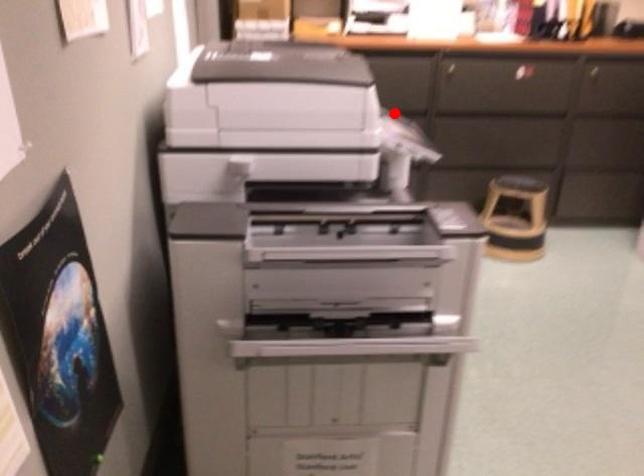
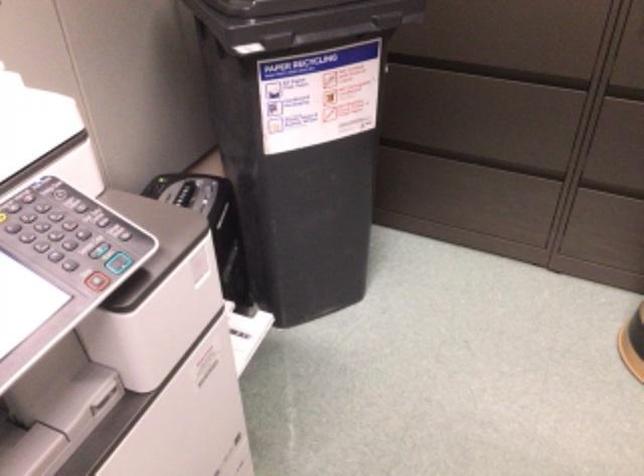
In the second image, find the point that corresponds to the highlighted location in the first image.

(507, 73)